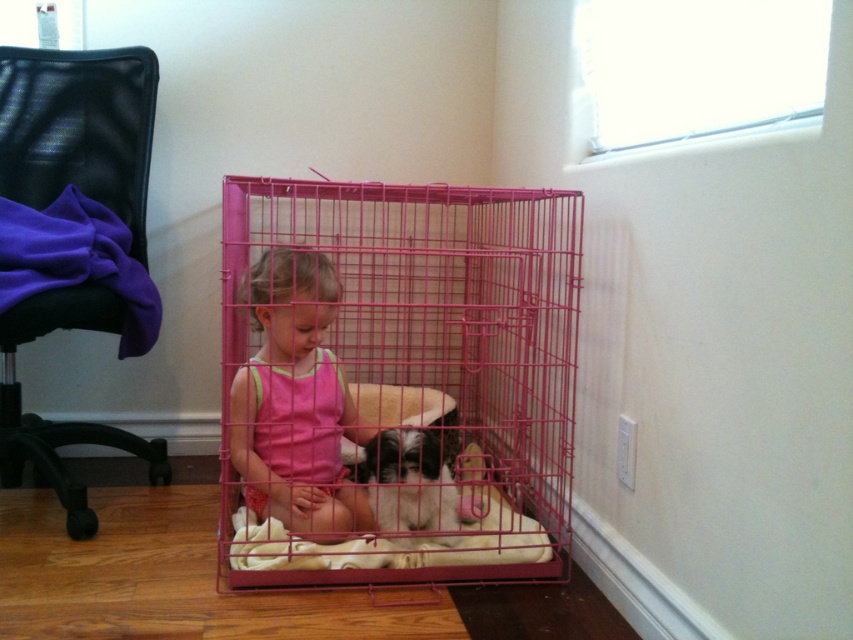
Question: Which of the following is the farthest from the observer?

Choices:
 (A) pink fabric child at center
 (B) pink wire cage at center

Answer: (A)

Question: Which of these objects is positioned farthest from the pink fabric child at center?

Choices:
 (A) soft beige cushion at center
 (B) black and white fur at center

Answer: (A)

Question: Can you confirm if soft beige cushion at center is positioned to the right of black and white fur at center?

Choices:
 (A) yes
 (B) no

Answer: (B)

Question: Which point is closer to the camera?

Choices:
 (A) (376, 444)
 (B) (416, 540)

Answer: (A)

Question: Is pink fabric child at center to the left of soft beige cushion at center from the viewer's perspective?

Choices:
 (A) no
 (B) yes

Answer: (B)

Question: Is the position of pink fabric child at center less distant than that of black and white fur at center?

Choices:
 (A) no
 (B) yes

Answer: (B)